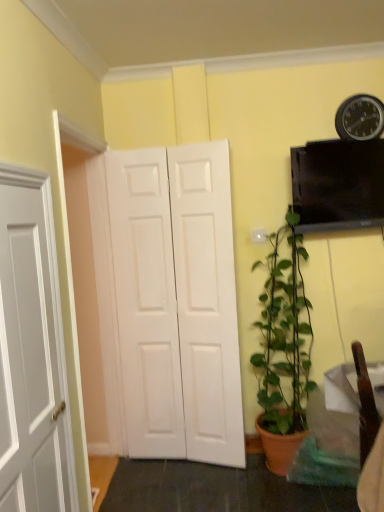
Question: In terms of size, does white matte door at center appear bigger or smaller than green matte plant at lower right?

Choices:
 (A) big
 (B) small

Answer: (B)

Question: From their relative heights in the image, would you say white matte door at center is taller or shorter than green matte plant at lower right?

Choices:
 (A) short
 (B) tall

Answer: (B)

Question: Which of these objects is positioned closest to the metallic black clock at upper right?

Choices:
 (A) white matte door at center
 (B) green matte plant at lower right

Answer: (B)

Question: Estimate the real-world distances between objects in this image. Which object is closer to the green matte plant at lower right?

Choices:
 (A) white matte door at center
 (B) metallic black clock at upper right

Answer: (A)